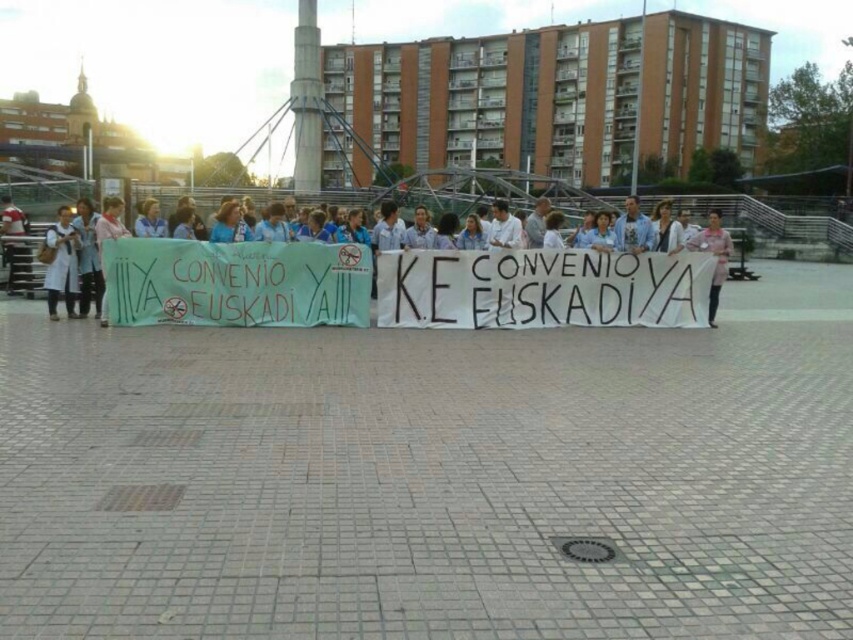
You are a photographer trying to capture a group photo of the people in the plaza. You notice two individuals wearing light blue shirts. One is at the center and the other at the left. If you want to frame the person in the light blue shirt at left so they are on the far left of the photo, should you position the light blue shirt at center to the right or left of them?

The light blue shirt at center is positioned on the right side of the light blue shirt at left. To frame the light blue shirt at left on the far left, you should position the light blue shirt at center to the right of them.

You are a photographer trying to capture a photo of the light blue shirt at center and pink fabric at center. Based on their positions, which one should you focus on first if you want to include both in the frame without moving the camera?

The light blue shirt at center is positioned on the left side of pink fabric at center, so you should focus on the light blue shirt at center first to ensure both are in frame without moving the camera.